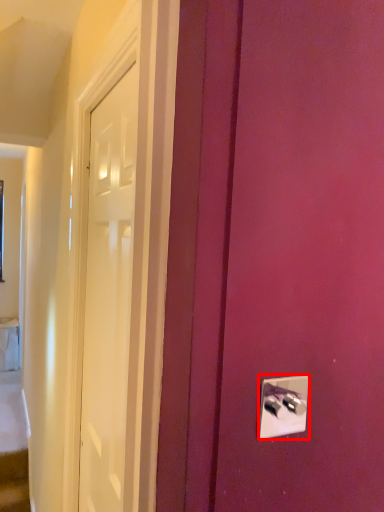
Question: From the image's perspective, what is the correct spatial positioning of light switch (annotated by the red box) in reference to door?

Choices:
 (A) above
 (B) below

Answer: (A)